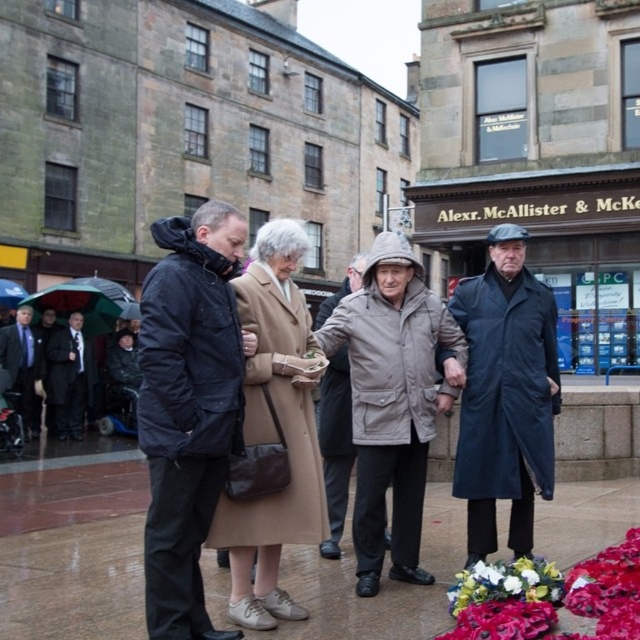
Question: Considering the relative positions of fluffy fabric bouquet at lower right and transparent plastic umbrella at upper left in the image provided, where is fluffy fabric bouquet at lower right located with respect to transparent plastic umbrella at upper left?

Choices:
 (A) above
 (B) below

Answer: (B)

Question: Based on their relative distances, which object is farther from the light beige hooded jacket at center?

Choices:
 (A) green fabric umbrella at left
 (B) beige wool coat at center
 (C) fluffy fabric bouquet at lower right

Answer: (A)

Question: Is dark blue jacket at center wider than light beige hooded jacket at center?

Choices:
 (A) no
 (B) yes

Answer: (B)

Question: Is dark blue jacket at center to the right of beige wool coat at center from the viewer's perspective?

Choices:
 (A) no
 (B) yes

Answer: (A)

Question: Considering the real-world distances, which object is closest to the beige wool coat at center?

Choices:
 (A) dark blue jacket at center
 (B) transparent plastic umbrella at upper left

Answer: (A)

Question: Which point is farther to the camera?

Choices:
 (A) light beige hooded jacket at center
 (B) fluffy fabric bouquet at lower right

Answer: (A)